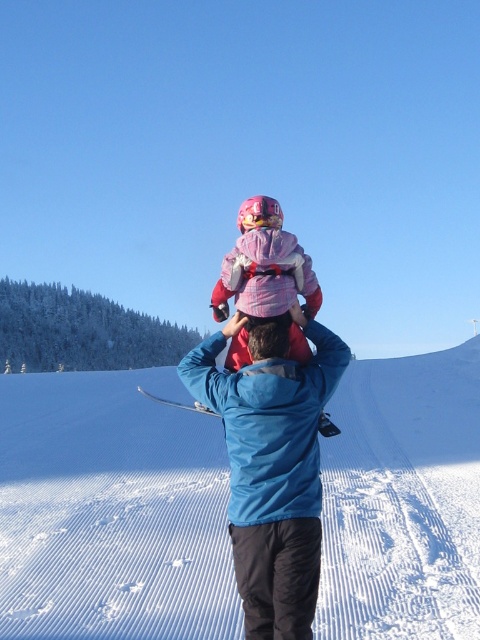
From the picture: Is blue fabric jacket at center further to camera compared to metallic silver ski at center?

No, it is in front of metallic silver ski at center.

Who is more forward, (x=199, y=362) or (x=160, y=401)?

Point (x=199, y=362)

Measure the distance between blue fabric jacket at center and camera.

The distance of blue fabric jacket at center from camera is 2.95 meters.

You are a GUI agent. You are given a task and a screenshot of the screen. Output one action in this format:
    pyautogui.click(x=<x>, y=<y>)
    Task: Click on the blue fabric jacket at center
    Image resolution: width=480 pixels, height=640 pixels.
    Given the screenshot: What is the action you would take?
    pyautogui.click(x=272, y=468)

Which is above, white snow at center or blue fabric jacket at center?

Positioned higher is blue fabric jacket at center.

Can you confirm if white snow at center is bigger than blue fabric jacket at center?

Indeed, white snow at center has a larger size compared to blue fabric jacket at center.

Locate an element on the screen. white snow at center is located at coordinates (111, 512).

Does point (275, 355) lie in front of point (278, 276)?

Yes, point (275, 355) is in front of point (278, 276).

Between blue fabric jacket at center and pink fleece jacket at center, which one is positioned higher?

pink fleece jacket at center is higher up.

Between point (308, 628) and point (257, 253), which one is positioned in front?

Point (308, 628) is in front.

Identify the location of blue fabric jacket at center. The height and width of the screenshot is (640, 480). (272, 468).